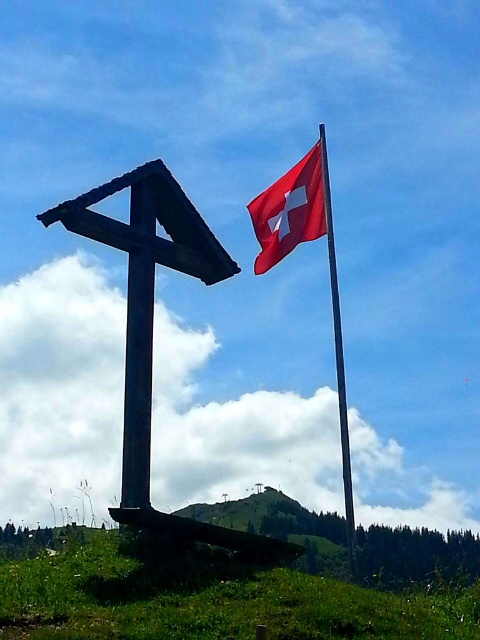
Question: Based on their relative distances, which object is farther from the red fabric flag at upper right?

Choices:
 (A) green grassy hillside at lower center
 (B) dark brown wooden cross at left
 (C) red fabric flag pole at upper center

Answer: (A)

Question: Which of the following is the farthest from the observer?

Choices:
 (A) red fabric flag at upper right
 (B) green grassy hillside at lower center

Answer: (A)

Question: Which is nearer to the dark brown wooden cross at left?

Choices:
 (A) green grassy hillside at lower center
 (B) red fabric flag at upper right
 (C) red fabric flag pole at upper center

Answer: (B)

Question: Observing the image, what is the correct spatial positioning of dark brown wooden cross at left in reference to red fabric flag at upper right?

Choices:
 (A) above
 (B) below

Answer: (B)

Question: Is dark brown wooden cross at left to the left of red fabric flag pole at upper center from the viewer's perspective?

Choices:
 (A) yes
 (B) no

Answer: (A)

Question: Does dark brown wooden cross at left appear on the left side of red fabric flag pole at upper center?

Choices:
 (A) no
 (B) yes

Answer: (B)